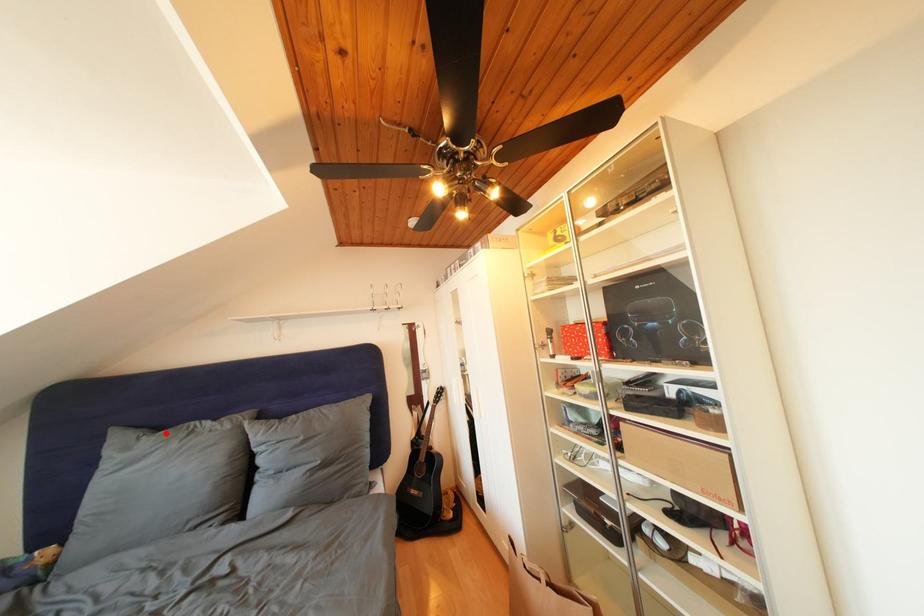
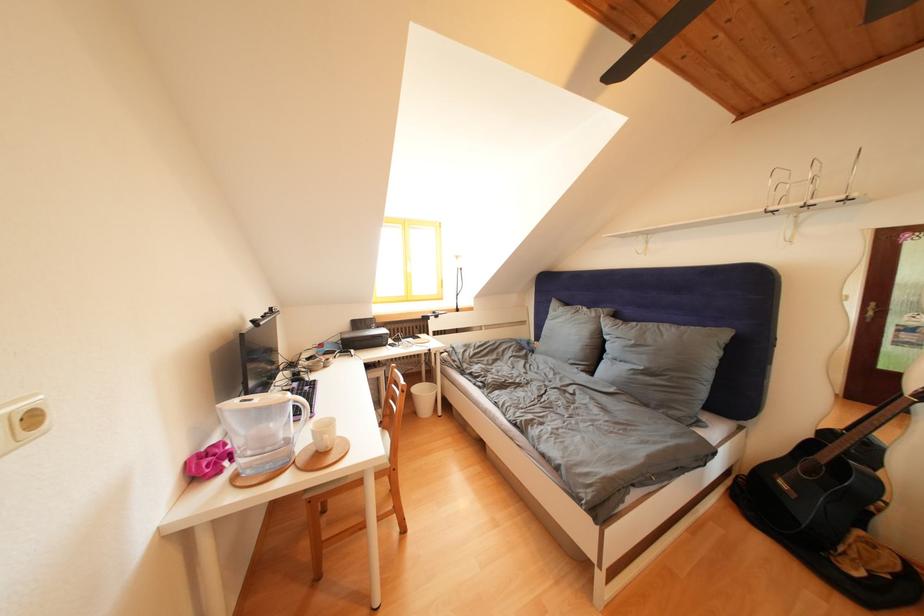
Find the pixel in the second image that matches the highlighted location in the first image.

(575, 310)